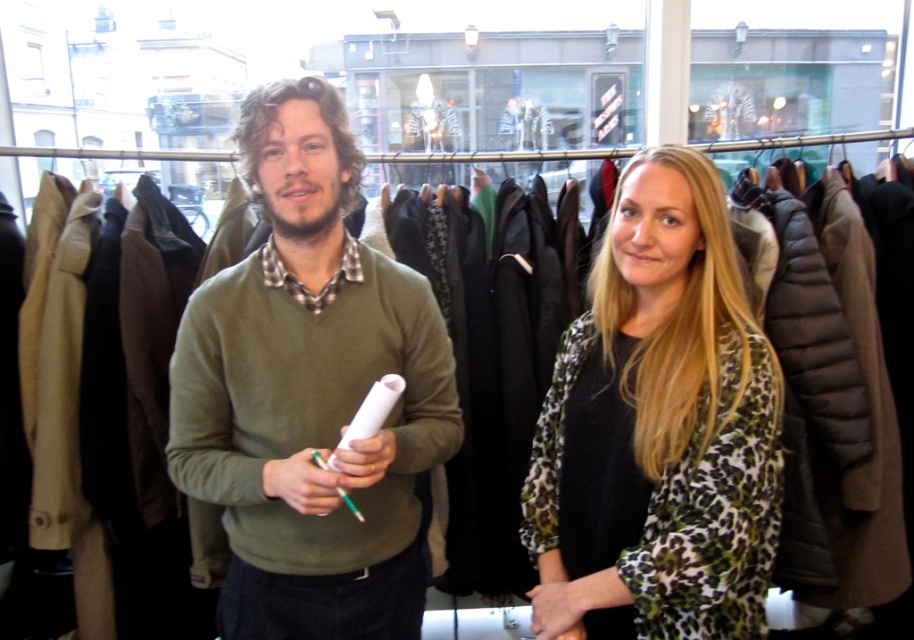
You are trying to decide between two items in a store. You see the green matte sweater at center and the leopard print blouse at center. Which one is larger?

The green matte sweater at center is bigger than the leopard print blouse at center.

Looking at this image, based on the scene description, where is the green matte sweater at center located in terms of its 2D coordinates?

The green matte sweater at center is located at the 2D coordinates point (310, 394).